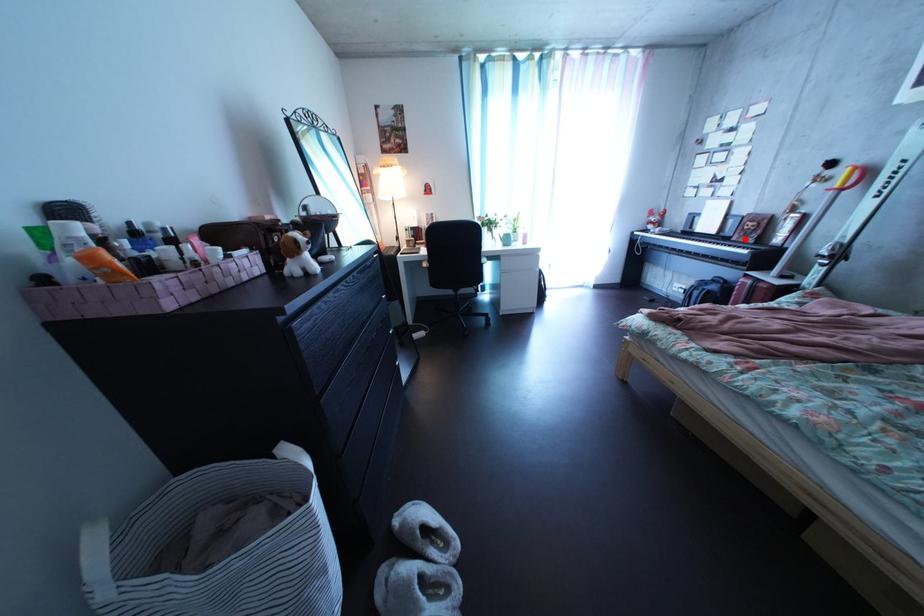
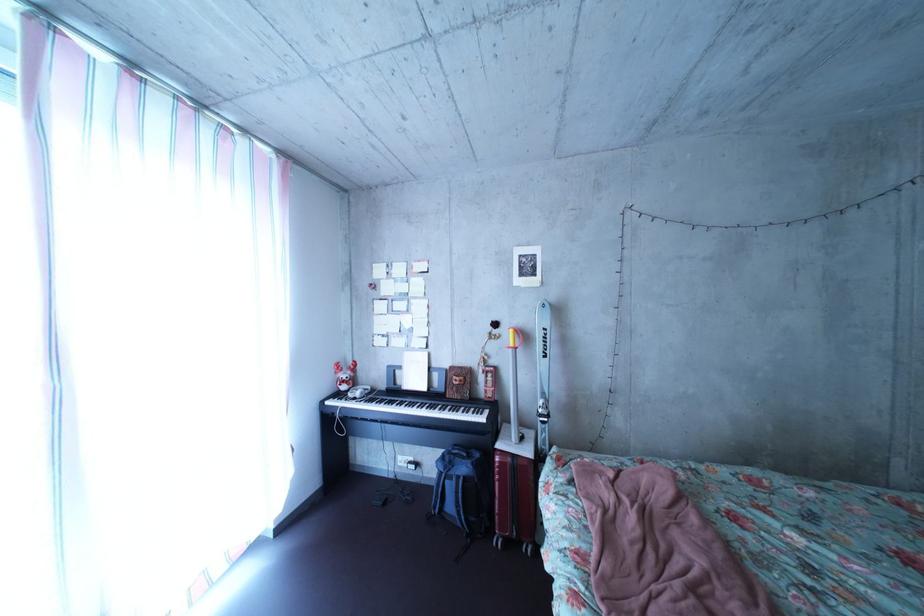
Question: I am providing you with two images of the same scene from different viewpoints. In image1, a red point is highlighted. Considering the same 3D point in image2, which of the following is correct?

Choices:
 (A) It is closer
 (B) It is farther

Answer: (B)